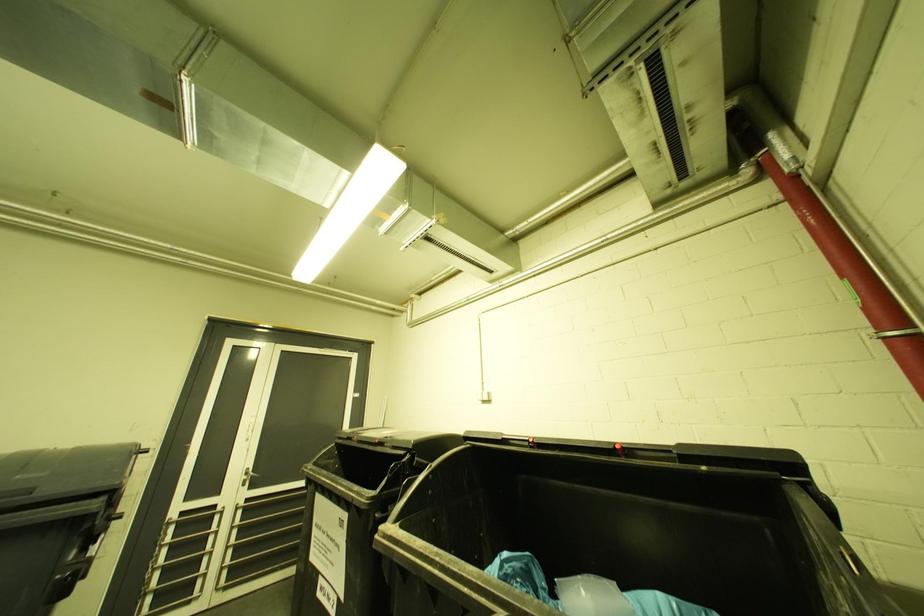
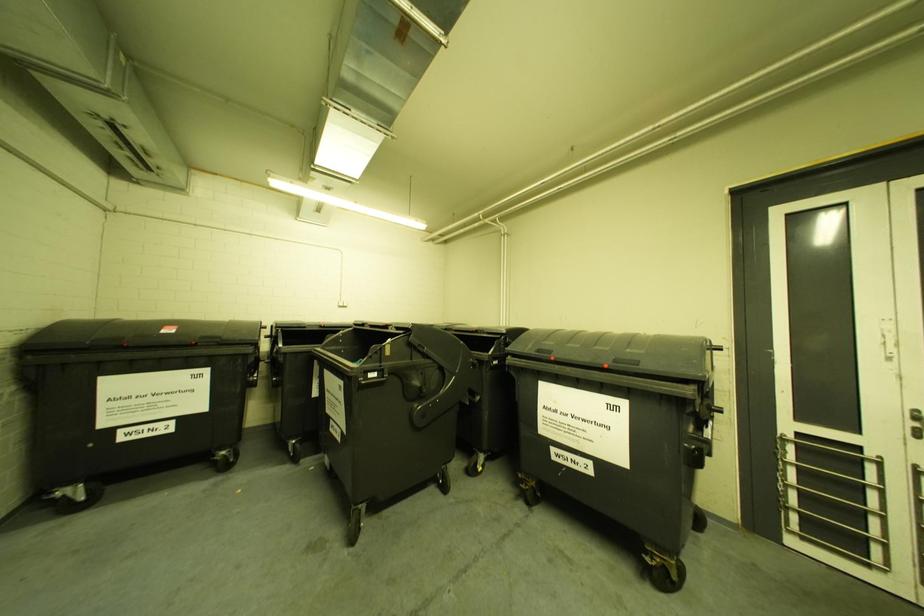
Question: The images are taken continuously from a first-person perspective. In which direction is your viewpoint rotating?

Choices:
 (A) Left
 (B) Right
 (C) Up
 (D) Down

Answer: (A)